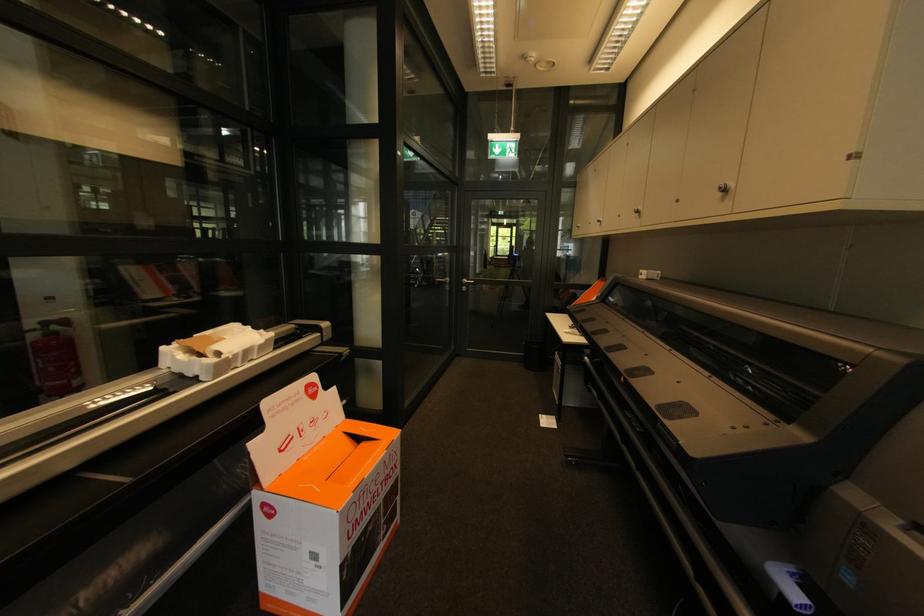
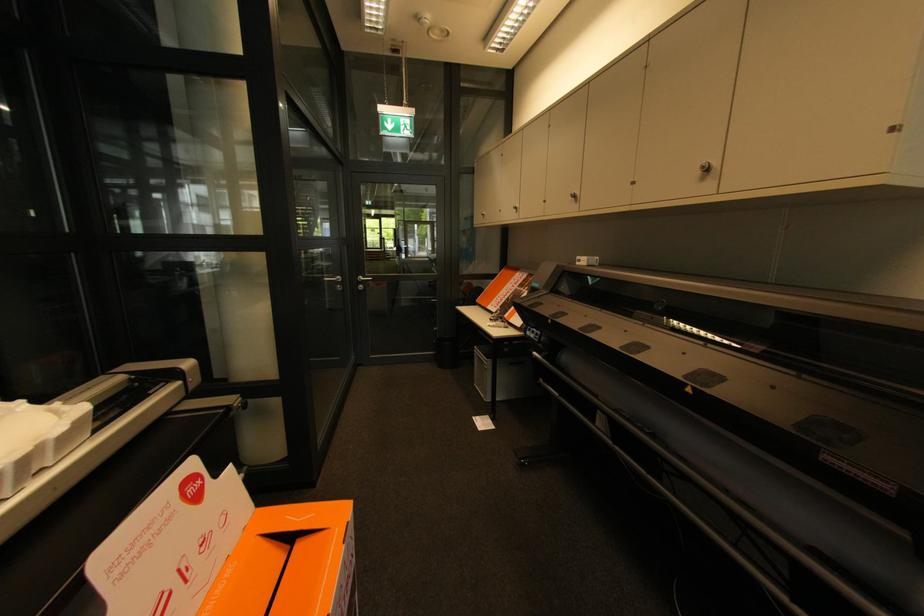
The point at (723, 188) is marked in the first image. Where is the corresponding point in the second image?

(707, 168)